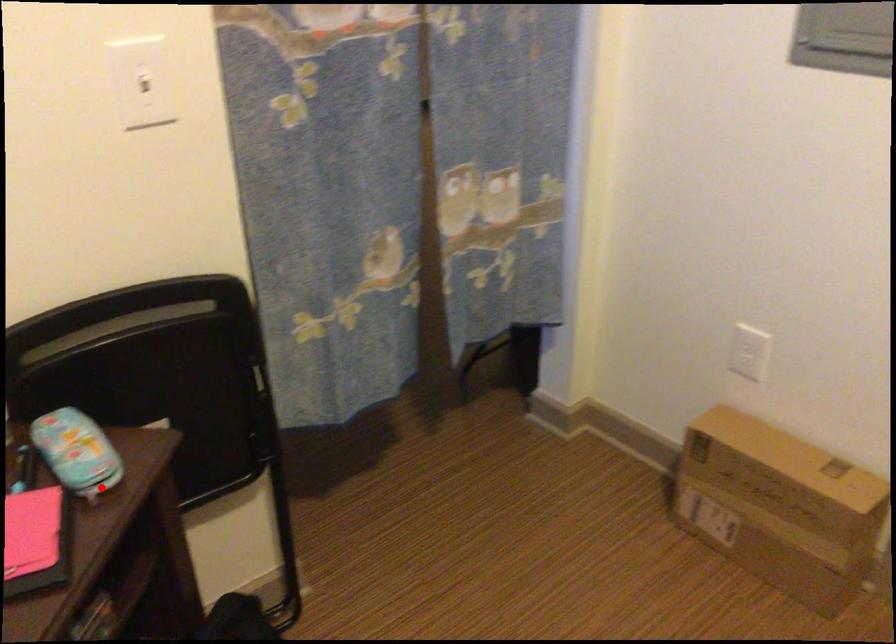
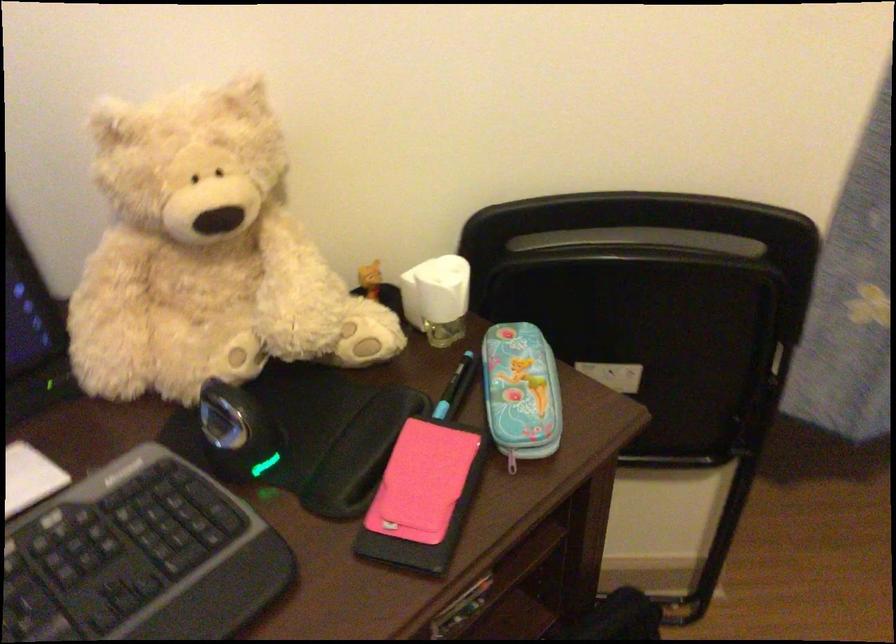
Where in the second image is the point corresponding to the highlighted location from the first image?

(512, 460)